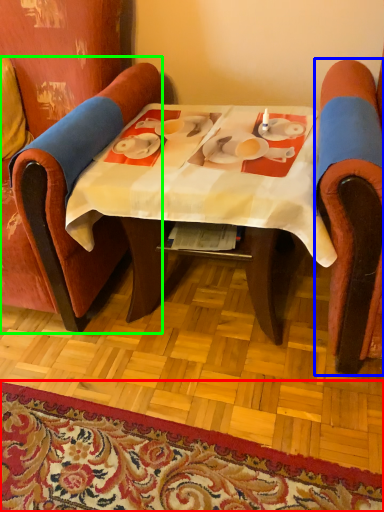
Question: Based on their relative distances, which object is farther from mat (highlighted by a red box)? Choose from chair (highlighted by a blue box) and chair (highlighted by a green box).

Choices:
 (A) chair
 (B) chair

Answer: (A)